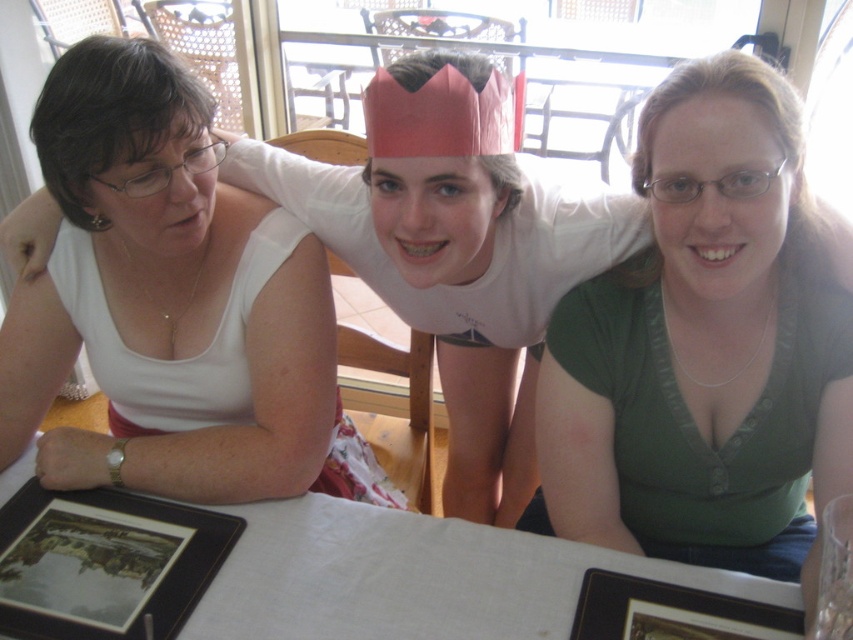
Who is more distant from viewer, (715, 513) or (270, 609)?

Positioned behind is point (715, 513).

Who is higher up, green matte shirt at center or white cloth table at center?

green matte shirt at center is higher up.

Locate an element on the screen. Image resolution: width=853 pixels, height=640 pixels. green matte shirt at center is located at coordinates tap(704, 346).

Where is `green matte shirt at center`? green matte shirt at center is located at coordinates (704, 346).

Does green matte shirt at center appear over black matte picture frame at lower right?

Yes, green matte shirt at center is above black matte picture frame at lower right.

Who is more distant from viewer, (751, 227) or (762, 620)?

Positioned behind is point (762, 620).

The height and width of the screenshot is (640, 853). I want to click on green matte shirt at center, so click(x=704, y=346).

Is matte white tank top at left positioned at the back of black matte picture frame at lower left?

Yes, it is.

Is point (276, 268) positioned in front of point (193, 595)?

No, (276, 268) is further to viewer.

Where is `matte white tank top at left`? matte white tank top at left is located at coordinates (196, 272).

At what (x,y) coordinates should I click in order to perform the action: click on matte white tank top at left. Please return your answer as a coordinate pair (x, y). The height and width of the screenshot is (640, 853). Looking at the image, I should click on tap(196, 272).